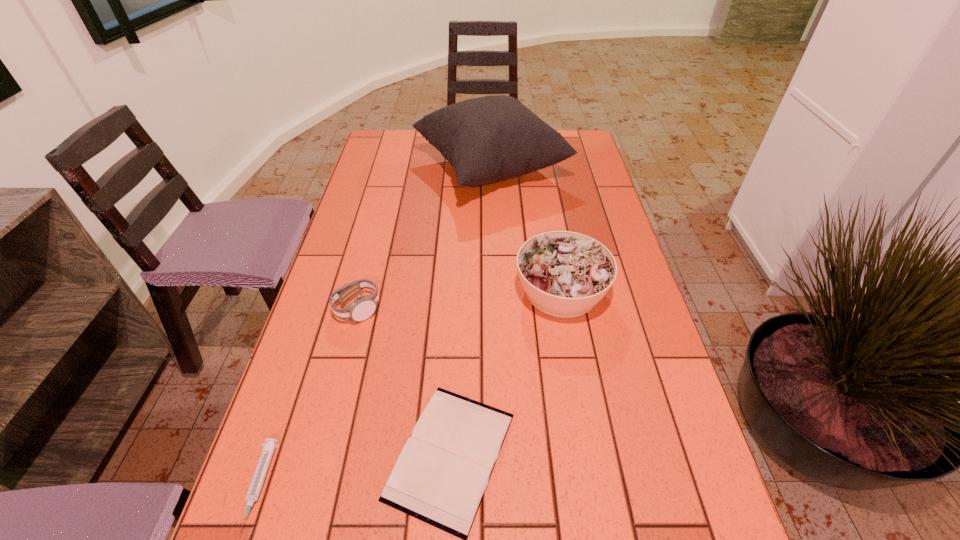
The width and height of the screenshot is (960, 540). I want to click on watch situated at the left edge, so click(363, 307).

Identify the location of syringe at the left edge. The height and width of the screenshot is (540, 960). (253, 493).

Identify the location of cushion situated at the right edge. Image resolution: width=960 pixels, height=540 pixels. (488, 139).

Find the location of a particular element. salad that is at the right edge is located at coordinates (565, 274).

Image resolution: width=960 pixels, height=540 pixels. What are the coordinates of `object at the far right corner` in the screenshot? It's located at (488, 139).

Where is `vacant space at the left edge of the desktop`? The image size is (960, 540). vacant space at the left edge of the desktop is located at coordinates (356, 257).

You are a GUI agent. You are given a task and a screenshot of the screen. Output one action in this format:
    pyautogui.click(x=<x>, y=<y>)
    Task: Click on the free location at the right edge of the desktop
    The width and height of the screenshot is (960, 540).
    Given the screenshot: What is the action you would take?
    pyautogui.click(x=587, y=234)

At what (x,y) coordinates should I click in order to perform the action: click on free space at the far left corner. Please return your answer as a coordinate pair (x, y). This screenshot has width=960, height=540. Looking at the image, I should click on (377, 130).

Find the location of a particular element. The image size is (960, 540). free spot between the third tallest object and the leftmost object is located at coordinates (308, 398).

Find the location of a particular element. free space between the farthest object and the fourth shortest object is located at coordinates (526, 230).